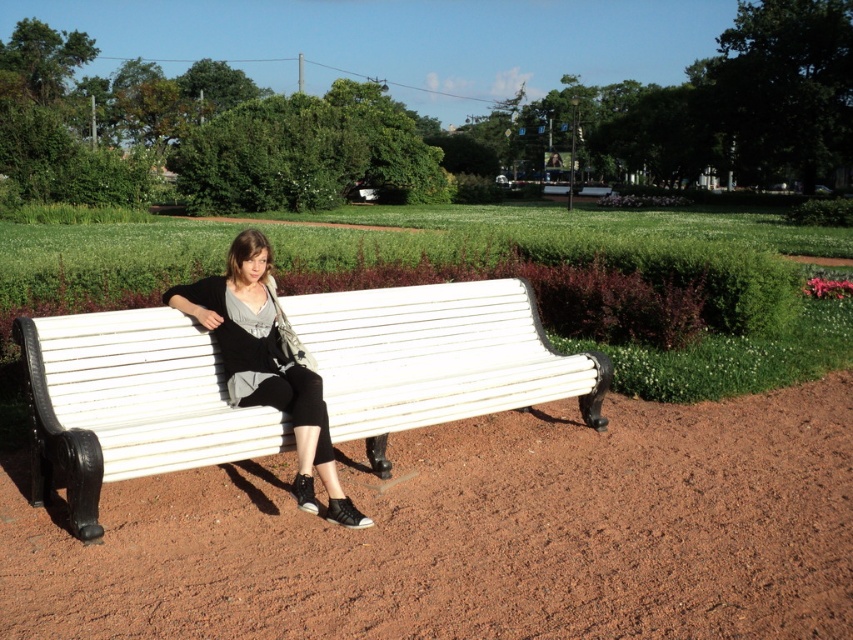
Question: Does white painted wood bench at center have a smaller size compared to matte black pants at center?

Choices:
 (A) no
 (B) yes

Answer: (A)

Question: Which of the following is the closest to the observer?

Choices:
 (A) (334, 474)
 (B) (131, 310)

Answer: (A)

Question: Does white painted wood bench at center have a larger size compared to matte black pants at center?

Choices:
 (A) no
 (B) yes

Answer: (B)

Question: Does white painted wood bench at center appear on the left side of matte black pants at center?

Choices:
 (A) yes
 (B) no

Answer: (B)